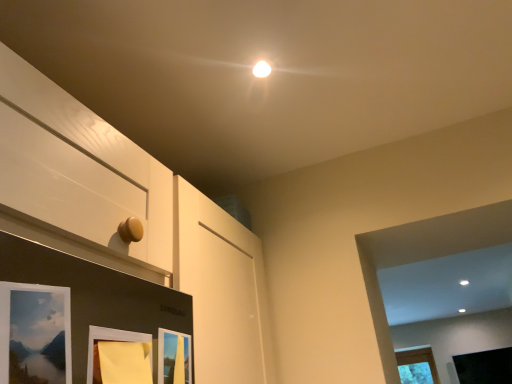
Question: From the image's perspective, relative to black matte picture frame at lower right, the 1th picture frame when ordered from bottom to top, is yellow paper at lower center, the 3th picture frame in the right-to-left sequence, above or below?

Choices:
 (A) above
 (B) below

Answer: (A)

Question: Relative to black matte picture frame at lower right, the fourth picture frame positioned from the left, is yellow paper at lower center, arranged as the second picture frame when viewed from the front, in front or behind?

Choices:
 (A) front
 (B) behind

Answer: (A)

Question: Estimate the real-world distances between objects in this image. Which object is closer to the black matte picture frame at lower right, the fourth picture frame positioned from the left?

Choices:
 (A) matte wooden picture frame at lower left, acting as the fourth picture frame starting from the back
 (B) matte wooden picture frame at lower center, the 3th picture frame when ordered from left to right
 (C) yellow paper at lower center, the 3th picture frame in the right-to-left sequence

Answer: (B)

Question: Which object is positioned closest to the yellow paper at lower center, positioned as the 2th picture frame in left-to-right order?

Choices:
 (A) black matte picture frame at lower right, the fourth picture frame positioned from the left
 (B) matte wooden picture frame at lower center, the 3th picture frame when ordered from left to right
 (C) matte wooden picture frame at lower left, which ranks as the 4th picture frame in bottom-to-top order

Answer: (B)